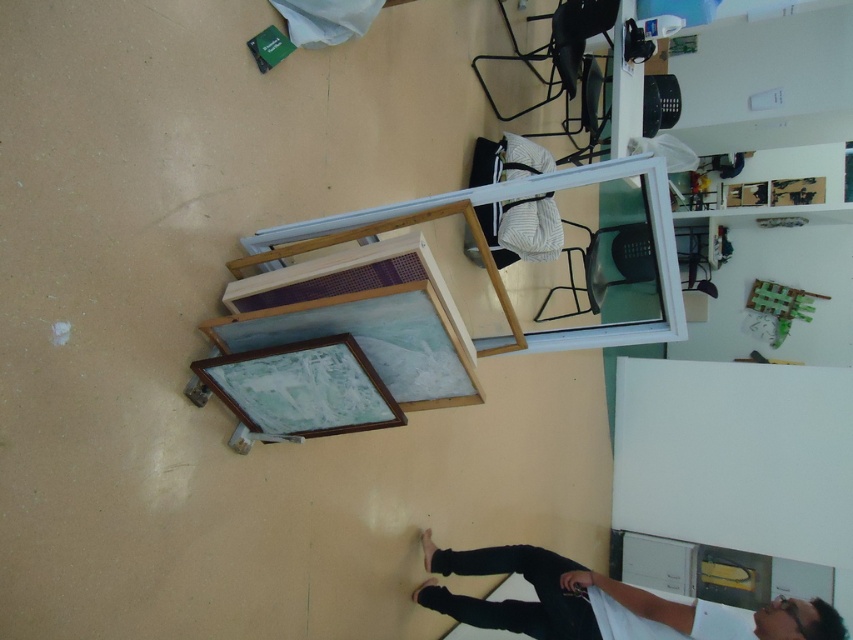
Find the location of a particular element. The width and height of the screenshot is (853, 640). wooden picture frame at lower center is located at coordinates (300, 388).

Measure the distance between wooden picture frame at lower center and camera.

A distance of 1.90 meters exists between wooden picture frame at lower center and camera.

Which is in front, point (276, 376) or point (380, 225)?

Positioned in front is point (380, 225).

The height and width of the screenshot is (640, 853). Identify the location of wooden picture frame at lower center. (300, 388).

Consider the image. Between white matte shirt at lower right and wooden picture frame at lower center, which one appears on the right side from the viewer's perspective?

From the viewer's perspective, white matte shirt at lower right appears more on the right side.

Is white matte shirt at lower right bigger than wooden picture frame at lower center?

Yes.

What do you see at coordinates (598, 602) in the screenshot? I see `white matte shirt at lower right` at bounding box center [598, 602].

I want to click on white matte shirt at lower right, so click(598, 602).

Who is more forward, [308,312] or [386,397]?

Point [308,312]

Can you confirm if wooden frame at lower center is bigger than wooden picture frame at lower center?

Correct, wooden frame at lower center is larger in size than wooden picture frame at lower center.

The height and width of the screenshot is (640, 853). Identify the location of wooden frame at lower center. (370, 339).